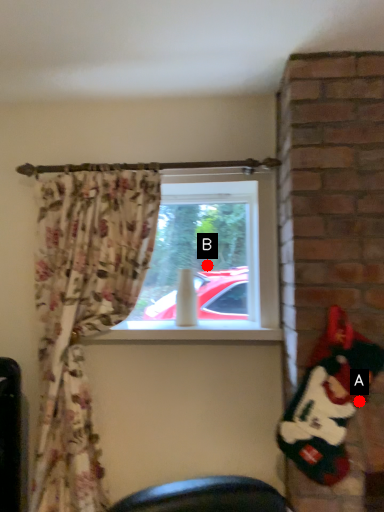
Question: Two points are circled on the image, labeled by A and B beside each circle. Which point is closer to the camera?

Choices:
 (A) A is closer
 (B) B is closer

Answer: (A)